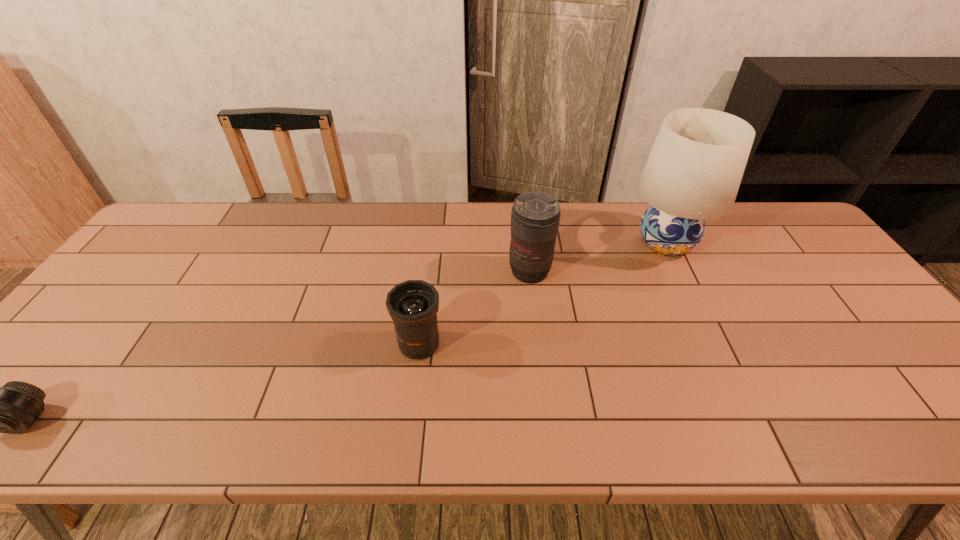
This screenshot has height=540, width=960. What are the coordinates of `vacant space at the far edge of the desktop` in the screenshot? It's located at (303, 204).

Find the location of a particular element. The width and height of the screenshot is (960, 540). vacant space at the near edge of the desktop is located at coordinates (825, 429).

Where is `vacant region at the left edge`? The image size is (960, 540). vacant region at the left edge is located at coordinates (92, 329).

In the image, there is a desktop. Where is `vacant space at the far right corner`? vacant space at the far right corner is located at coordinates (738, 209).

This screenshot has height=540, width=960. In order to click on free point between the lampshade and the third object from left to right in this screenshot , I will do `click(598, 257)`.

Where is `vacant area that lies between the second tallest object and the lampshade`? vacant area that lies between the second tallest object and the lampshade is located at coordinates (598, 257).

Locate an element on the screen. This screenshot has height=540, width=960. free spot between the second telephoto lens from left to right and the rightmost telephoto lens is located at coordinates (474, 308).

Select which object appears as the third closest to the second farthest telephoto lens. Please provide its 2D coordinates. Your answer should be formatted as a tuple, i.e. [(x, y)], where the tuple contains the x and y coordinates of a point satisfying the conditions above.

[(13, 408)]

Locate which object is the second closest to the shortest telephoto lens. Please provide its 2D coordinates. Your answer should be formatted as a tuple, i.e. [(x, y)], where the tuple contains the x and y coordinates of a point satisfying the conditions above.

[(535, 216)]

Where is `the closest telephoto lens to the third object from left to right`? Image resolution: width=960 pixels, height=540 pixels. the closest telephoto lens to the third object from left to right is located at coordinates (413, 305).